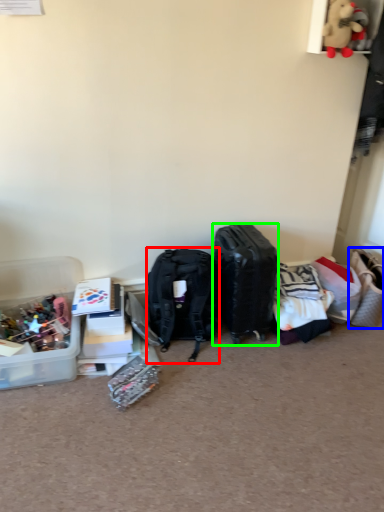
Question: Estimate the real-world distances between objects in this image. Which object is farther from backpack (highlighted by a red box), handbag (highlighted by a blue box) or luggage and bags (highlighted by a green box)?

Choices:
 (A) handbag
 (B) luggage and bags

Answer: (A)